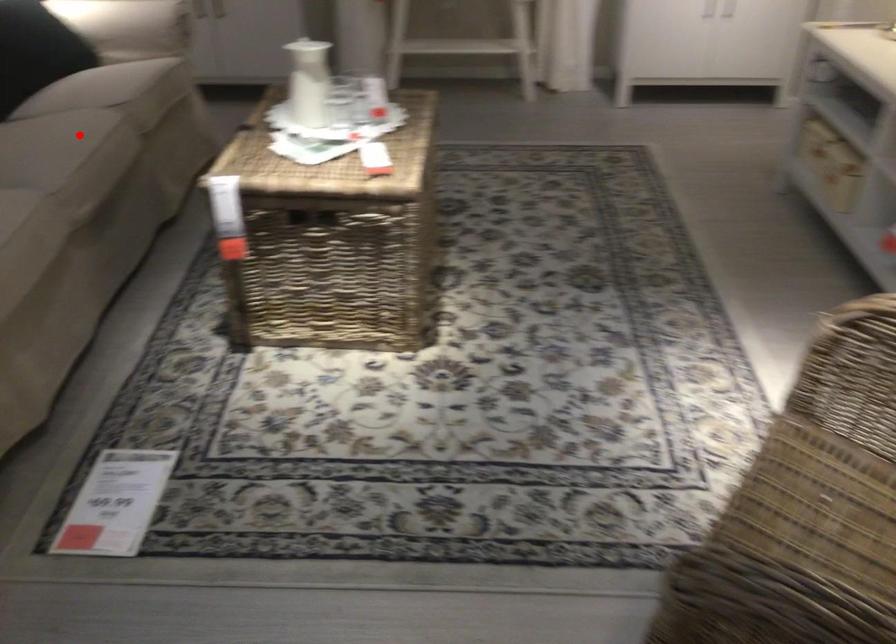
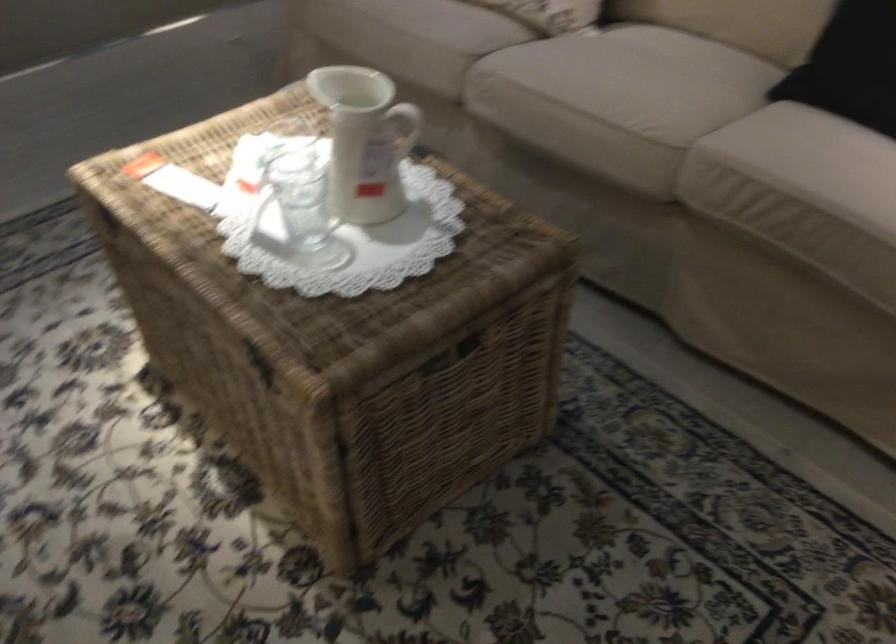
Question: I am providing you with two images of the same scene from different viewpoints. Image1 has a red point marked. In image2, the corresponding 3D location appears at what relative position? Reply with the corresponding letter.

Choices:
 (A) Closer
 (B) Farther

Answer: (A)